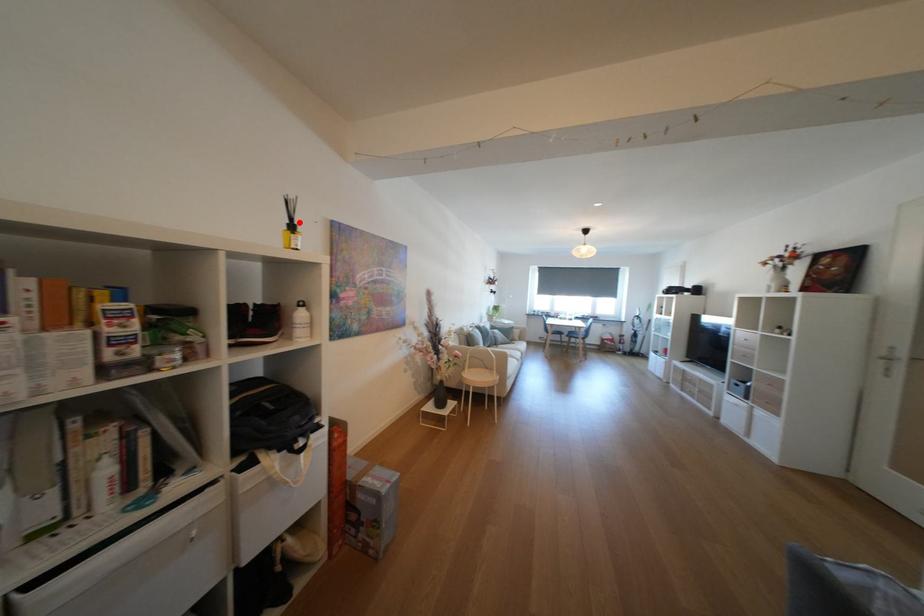
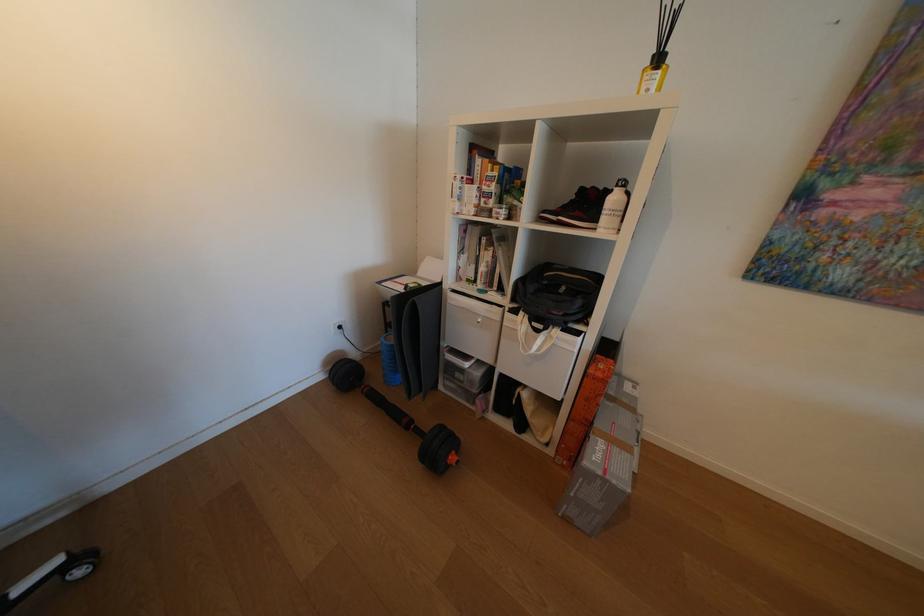
Where in the second image is the point corresponding to the highlighted location from the first image?

(665, 54)